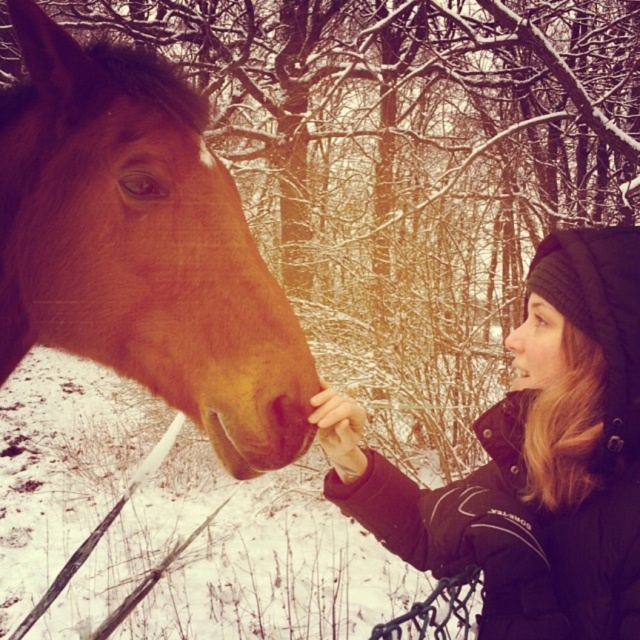
You are standing in the winter scene and want to place a small gift exactly at the point marked by coordinates point (141, 246). Which object in the scene is this point located on?

The point (141, 246) is located on the brown matte horse at left.

You are standing in the winter scene and want to place a small gift for the person at point (520,323). However, there is an object at point (552,477). Will the gift be visible to the person without moving the object?

Point (552,477) is in front of point (520,323), so the gift placed at point (520,323) will be blocked by the object at point (552,477) and thus not visible to the person.

You are a photographer standing in the winter scene. You want to take a photo of the brown matte horse at left and the black woolen beanie at upper right. The camera requires both subjects to be within 20 inches of each other to focus properly. Will the camera be able to focus on both?

The brown matte horse at left and the black woolen beanie at upper right are 18.62 inches apart, which is within the 20 inches requirement, so the camera can focus on both.